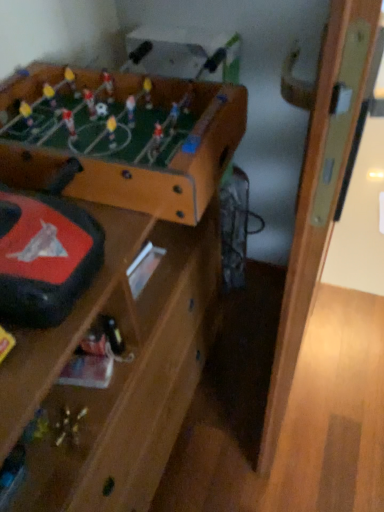
Looking at this image, what is the approximate width of wooden foosball table at upper left?

The width of wooden foosball table at upper left is 20.39 inches.

Image resolution: width=384 pixels, height=512 pixels. What do you see at coordinates (104, 340) in the screenshot? I see `metallic silver toy at center` at bounding box center [104, 340].

Where is `wooden foosball table at upper left`? wooden foosball table at upper left is located at coordinates (122, 138).

How different are the orientations of wooden door at right and wooden foosball table at upper left in degrees?

They differ by 2.08 degrees in their facing directions.

Is wooden door at right at the right side of wooden foosball table at upper left?

Yes, wooden door at right is to the right of wooden foosball table at upper left.

In the scene shown: Could wooden foosball table at upper left be considered to be inside wooden door at right?

That's incorrect, wooden foosball table at upper left is not inside wooden door at right.

Is point (4, 101) more distant than point (96, 346)?

Yes, it is.

In terms of height, does wooden foosball table at upper left look taller or shorter compared to metallic silver toy at center?

In the image, wooden foosball table at upper left appears to be taller than metallic silver toy at center.

Is wooden foosball table at upper left with metallic silver toy at center?

wooden foosball table at upper left and metallic silver toy at center are not in contact.

What are the coordinates of `toy behind the wooden foosball table at upper left` in the screenshot? It's located at (104, 340).

Which object is thinner, metallic silver toy at center or wooden foosball table at upper left?

Thinner between the two is metallic silver toy at center.

Which object is more forward, metallic silver toy at center or wooden foosball table at upper left?

Positioned in front is wooden foosball table at upper left.

In terms of height, does metallic silver toy at center look taller or shorter compared to wooden foosball table at upper left?

Clearly, metallic silver toy at center is shorter compared to wooden foosball table at upper left.

From a real-world perspective, is metallic silver toy at center on wooden foosball table at upper left?

No, from a real-world perspective, metallic silver toy at center is not above wooden foosball table at upper left.

Who is shorter, wooden foosball table at upper left or wooden door at right?

Standing shorter between the two is wooden foosball table at upper left.

Between wooden foosball table at upper left and wooden door at right, which one has smaller size?

With smaller size is wooden foosball table at upper left.

Between wooden foosball table at upper left and wooden door at right, which one has smaller width?

wooden door at right.

Would you say wooden foosball table at upper left is a long distance from wooden door at right?

wooden foosball table at upper left is near wooden door at right, not far away.

Can you see wooden door at right touching metallic silver toy at center?

wooden door at right and metallic silver toy at center are not in contact.

From the image's perspective, which object appears higher, wooden door at right or metallic silver toy at center?

wooden door at right.

Where is `toy on the left of wooden door at right`? toy on the left of wooden door at right is located at coordinates (104, 340).

Consider the image. Does metallic silver toy at center have a lesser height compared to wooden door at right?

Yes, metallic silver toy at center is shorter than wooden door at right.

Is metallic silver toy at center positioned with its back to wooden door at right?

No, wooden door at right is not at the back of metallic silver toy at center.

Is metallic silver toy at center completely or partially outside of wooden door at right?

Yes, metallic silver toy at center is located beyond the bounds of wooden door at right.

In the image, there is a wooden foosball table at upper left. Identify the location of door below it (from a real-world perspective). Image resolution: width=384 pixels, height=512 pixels. (318, 182).

Image resolution: width=384 pixels, height=512 pixels. Find the location of `table above the metallic silver toy at center (from a real-world perspective)`. table above the metallic silver toy at center (from a real-world perspective) is located at coordinates (122, 138).

When comparing their distances from wooden door at right, does wooden foosball table at upper left or metallic silver toy at center seem closer?

wooden foosball table at upper left is positioned closer to the anchor wooden door at right.

Based on their spatial positions, is metallic silver toy at center or wooden door at right further from wooden foosball table at upper left?

Based on the image, metallic silver toy at center appears to be further to wooden foosball table at upper left.

Which object lies nearer to the anchor point wooden foosball table at upper left, wooden door at right or metallic silver toy at center?

wooden door at right is positioned closer to the anchor wooden foosball table at upper left.

Considering their positions, is metallic silver toy at center positioned further to wooden door at right than wooden foosball table at upper left?

metallic silver toy at center is positioned further to the anchor wooden door at right.

Estimate the real-world distances between objects in this image. Which object is further from metallic silver toy at center, wooden foosball table at upper left or wooden door at right?

wooden door at right is further to metallic silver toy at center.

Considering their positions, is wooden door at right positioned further to metallic silver toy at center than wooden foosball table at upper left?

Among the two, wooden door at right is located further to metallic silver toy at center.

Find the location of `toy between wooden foosball table at upper left and wooden door at right in the horizontal direction`. toy between wooden foosball table at upper left and wooden door at right in the horizontal direction is located at coordinates (104, 340).